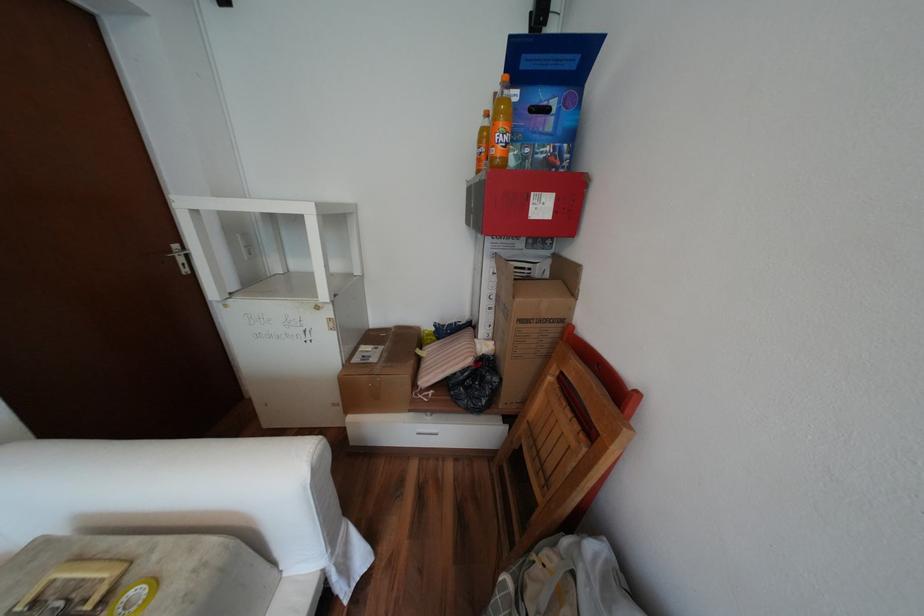
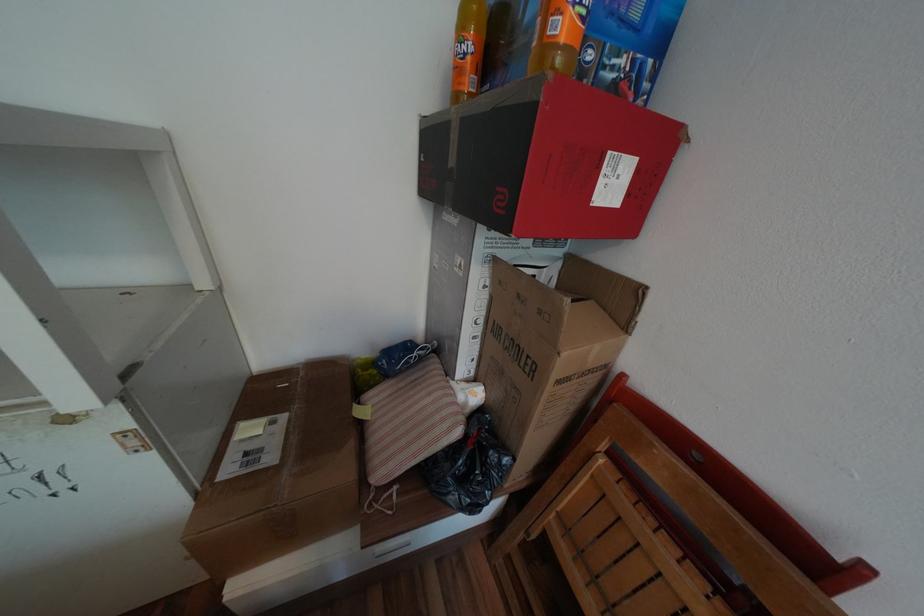
Question: The images are taken continuously from a first-person perspective. In which direction is your viewpoint rotating?

Choices:
 (A) Left
 (B) Right
 (C) Up
 (D) Down

Answer: (B)